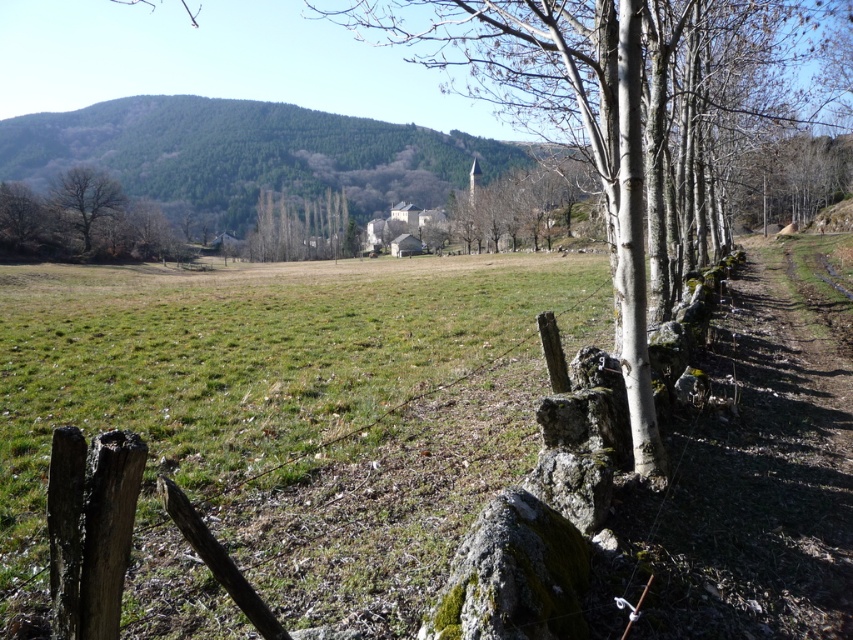
Looking at this image, is weathered wood fence at lower left positioned in front of brown rough tree at left?

Yes, it is.

The height and width of the screenshot is (640, 853). What do you see at coordinates (90, 528) in the screenshot?
I see `weathered wood fence at lower left` at bounding box center [90, 528].

The width and height of the screenshot is (853, 640). I want to click on weathered wood fence at lower left, so click(x=90, y=528).